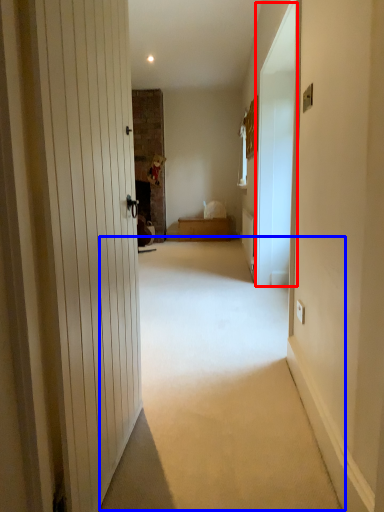
Question: Which object is closer to the camera taking this photo, screen door (highlighted by a red box) or corridor (highlighted by a blue box)?

Choices:
 (A) screen door
 (B) corridor

Answer: (B)